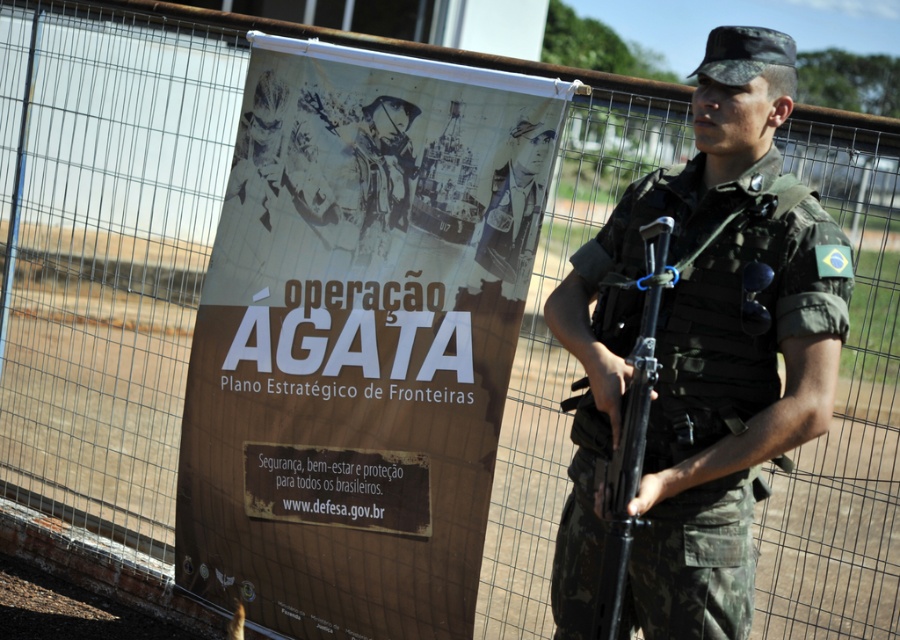
You are a photographer standing at a safe distance. You need to capture a clear photo of the banner behind the soldier. The banner is located at point (526, 243). Your camera has a minimum focus distance of 12 feet. Can you take the photo without moving closer?

The distance between the photographer and the banner at point (526, 243) is 13.87 feet, which is greater than the camera minimum focus distance of 12 feet. Therefore, the photographer can take the photo without moving closer.